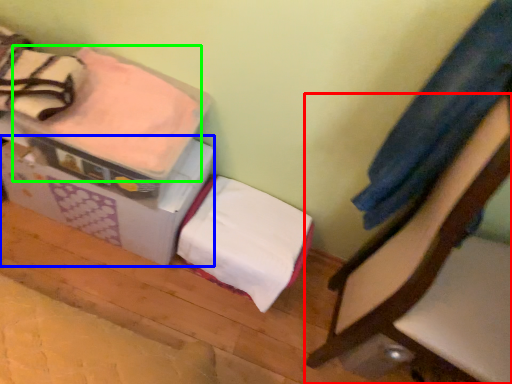
Question: Which is farther away from furniture (highlighted by a red box)? cardboard box (highlighted by a blue box) or blanket (highlighted by a green box)?

Choices:
 (A) cardboard box
 (B) blanket

Answer: (B)